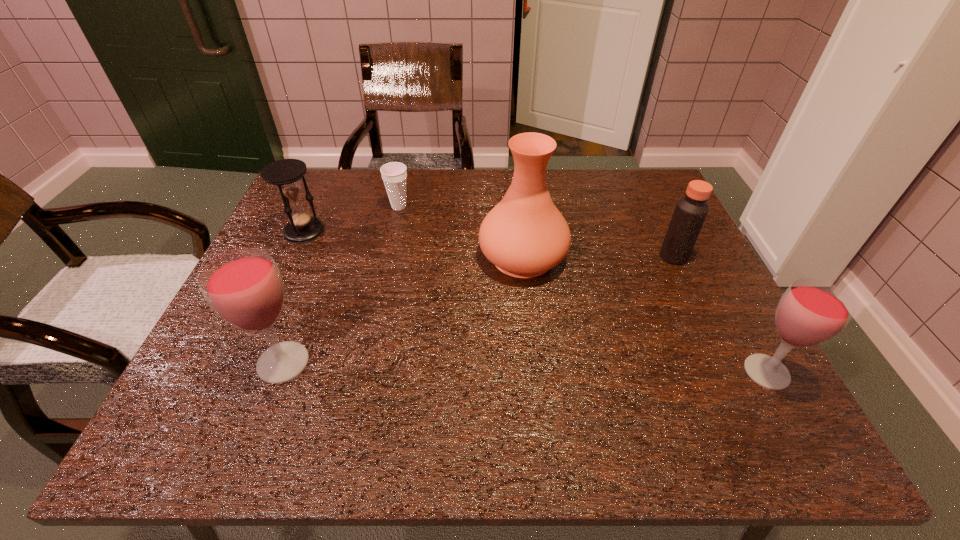
If equal spacing is desired by inserting an extra wineglass among them, please point out a free spot for this new wineglass. Please provide its 2D coordinates. Your answer should be formatted as a tuple, i.e. [(x, y)], where the tuple contains the x and y coordinates of a point satisfying the conditions above.

[(522, 367)]